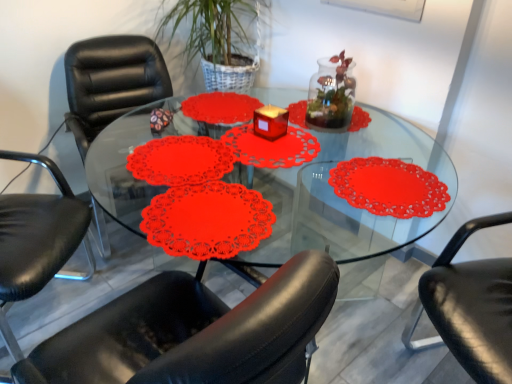
Question: Is transparent glass table at center oriented towards black leather chair at left, the second chair positioned from the right?

Choices:
 (A) yes
 (B) no

Answer: (B)

Question: Is transparent glass table at center located outside black leather chair at left, the second chair when ordered from left to right?

Choices:
 (A) no
 (B) yes

Answer: (B)

Question: Considering the relative positions of transparent glass table at center and black leather chair at left, the second chair positioned from the right, in the image provided, is transparent glass table at center behind black leather chair at left, the second chair positioned from the right,?

Choices:
 (A) yes
 (B) no

Answer: (B)

Question: From the image's perspective, is transparent glass table at center located above black leather chair at left, the second chair when ordered from left to right?

Choices:
 (A) yes
 (B) no

Answer: (B)

Question: Does transparent glass table at center have a smaller size compared to black leather chair at left, the second chair when ordered from left to right?

Choices:
 (A) yes
 (B) no

Answer: (B)

Question: Considering the positions of black leather chair at left, which is counted as the first chair, starting from the left, and black leather chair at lower right, which is counted as the first chair, starting from the right, in the image, is black leather chair at left, which is counted as the first chair, starting from the left, bigger or smaller than black leather chair at lower right, which is counted as the first chair, starting from the right,?

Choices:
 (A) big
 (B) small

Answer: (A)

Question: Considering the positions of black leather chair at left, which is counted as the first chair, starting from the left, and black leather chair at lower right, the 3th chair when ordered from left to right, in the image, is black leather chair at left, which is counted as the first chair, starting from the left, taller or shorter than black leather chair at lower right, the 3th chair when ordered from left to right,?

Choices:
 (A) short
 (B) tall

Answer: (B)

Question: Considering the positions of point (53, 243) and point (416, 317), is point (53, 243) closer or farther from the camera than point (416, 317)?

Choices:
 (A) farther
 (B) closer

Answer: (B)

Question: Based on their positions, is black leather chair at left, which is counted as the first chair, starting from the left, located to the left or right of black leather chair at lower right, the 3th chair when ordered from left to right?

Choices:
 (A) right
 (B) left

Answer: (B)

Question: Is black leather chair at lower right, the 3th chair when ordered from left to right, wider or thinner than transparent glass table at center?

Choices:
 (A) wide
 (B) thin

Answer: (B)

Question: In terms of size, does black leather chair at lower right, the 3th chair when ordered from left to right, appear bigger or smaller than transparent glass table at center?

Choices:
 (A) small
 (B) big

Answer: (A)

Question: Is black leather chair at lower right, which is counted as the first chair, starting from the right, inside the boundaries of transparent glass table at center, or outside?

Choices:
 (A) outside
 (B) inside

Answer: (A)

Question: From their relative heights in the image, would you say black leather chair at lower right, the 3th chair when ordered from left to right, is taller or shorter than transparent glass table at center?

Choices:
 (A) tall
 (B) short

Answer: (A)

Question: In the image, is transparent glass terrarium at center on the left side or the right side of matte red candle at center?

Choices:
 (A) right
 (B) left

Answer: (A)

Question: Considering their positions, is transparent glass terrarium at center located in front of or behind matte red candle at center?

Choices:
 (A) behind
 (B) front

Answer: (B)